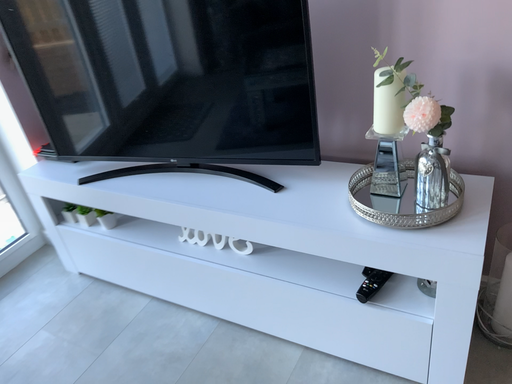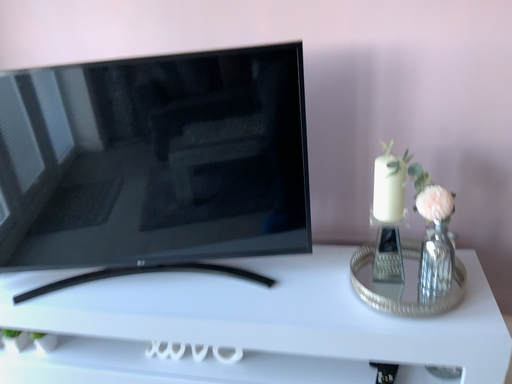
Question: Which way did the camera rotate in the video?

Choices:
 (A) rotated left
 (B) rotated right

Answer: (B)